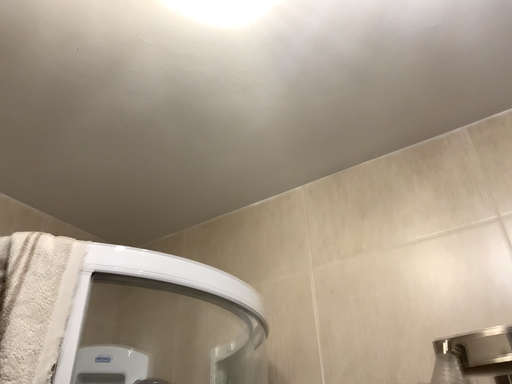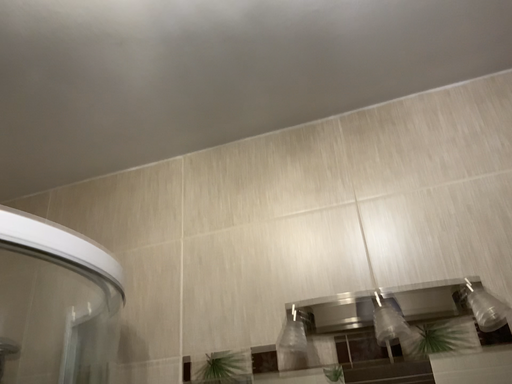
Question: How did the camera likely rotate when shooting the video?

Choices:
 (A) rotated left
 (B) rotated right

Answer: (B)